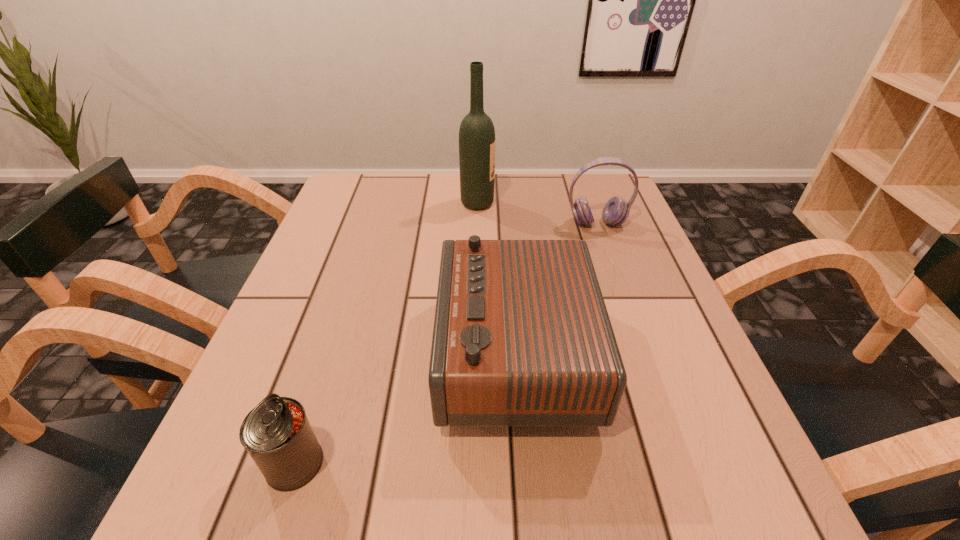
Image resolution: width=960 pixels, height=540 pixels. Identify the location of wine bottle. (476, 134).

Locate an element on the screen. This screenshot has width=960, height=540. the farthest object is located at coordinates (476, 134).

Locate an element on the screen. This screenshot has width=960, height=540. radio receiver is located at coordinates tap(522, 338).

Where is `the third nearest object`? The width and height of the screenshot is (960, 540). the third nearest object is located at coordinates (615, 212).

Where is `the rightmost object`? the rightmost object is located at coordinates (615, 212).

The image size is (960, 540). I want to click on the shortest object, so click(277, 434).

I want to click on the leftmost object, so click(277, 434).

Locate an element on the screen. The height and width of the screenshot is (540, 960). vacant region located on the labeled side of the tallest object is located at coordinates [x=524, y=204].

Locate an element on the screen. This screenshot has height=540, width=960. vacant space located 0.060m on the front panel of the radio receiver is located at coordinates (409, 353).

At what (x,y) coordinates should I click in order to perform the action: click on free space located 0.290m on the front panel of the radio receiver. Please return your answer as a coordinate pair (x, y). This screenshot has height=540, width=960. Looking at the image, I should click on pos(280,353).